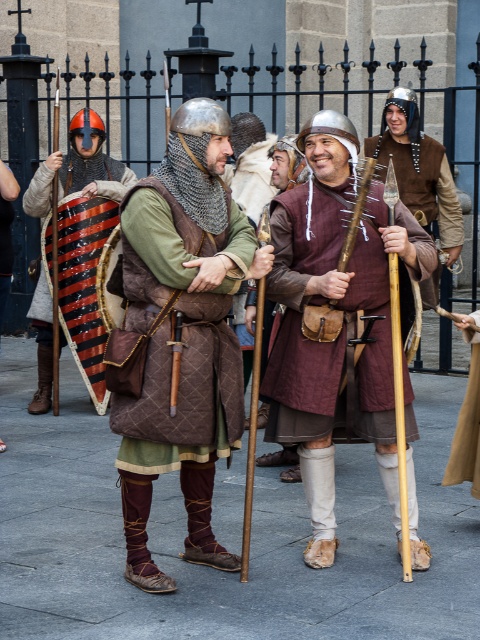
You are a medieval squire tasked with retrieving the striped leather shield at left for your knight. The knight is wearing the maroon quilted tunic at center. Which direction should you move to get the shield from your current position?

The maroon quilted tunic at center is to the right of the striped leather shield at left, so you should move to your left to retrieve the striped leather shield at left.

You are a participant in the medieval festival and need to retrieve your striped leather shield at left. You are currently standing near the light brown fabric skirt at center. Which direction should you move to reach your shield?

The striped leather shield at left is closer to you than the light brown fabric skirt at center, so you should move towards the left to reach your shield.